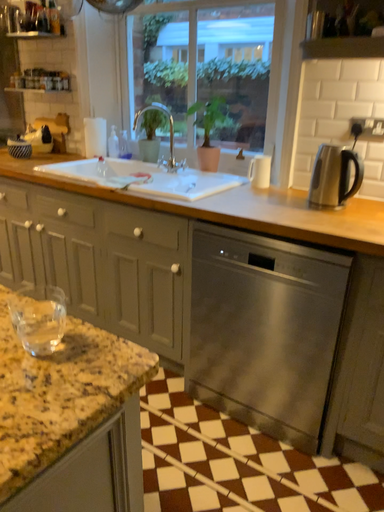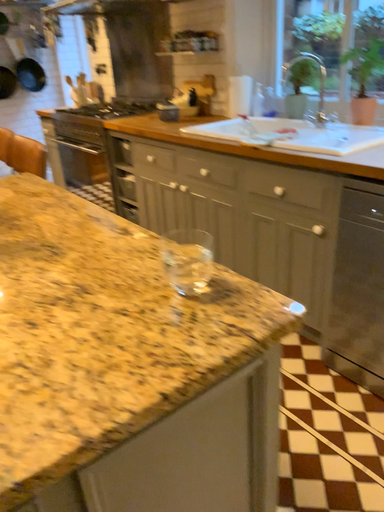
Question: Which way did the camera rotate in the video?

Choices:
 (A) rotated left
 (B) rotated right

Answer: (A)